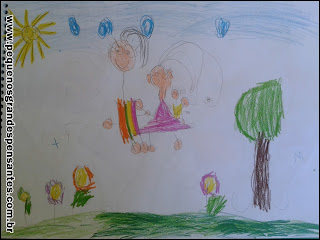
You are a GUI agent. You are given a task and a screenshot of the screen. Output one action in this format:
    pyautogui.click(x=<x>, y=<y>)
    Task: Click on the artwork
    
    Given the screenshot: What is the action you would take?
    pyautogui.click(x=155, y=104)